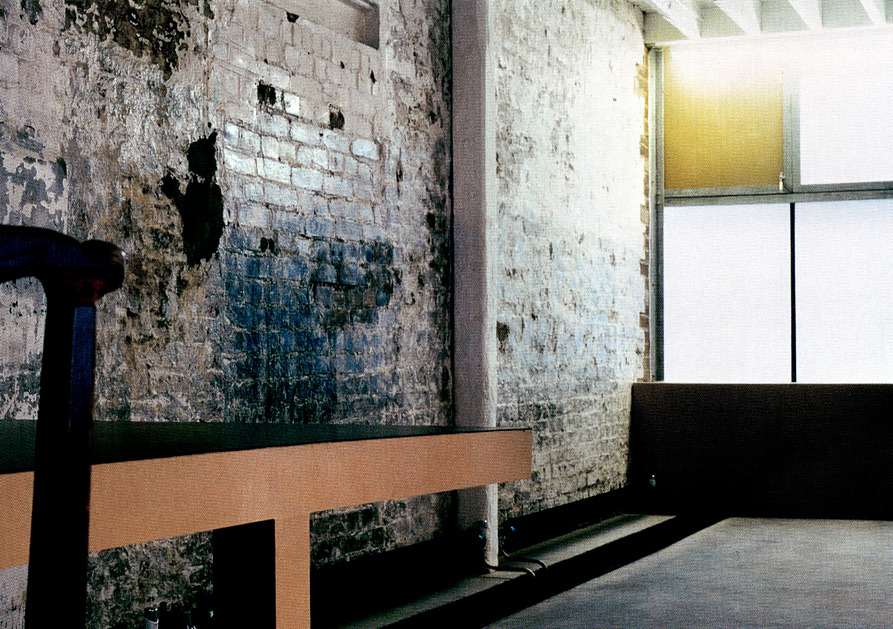
Find the location of a particular element. amber semi-transparent panel is located at coordinates (721, 120).